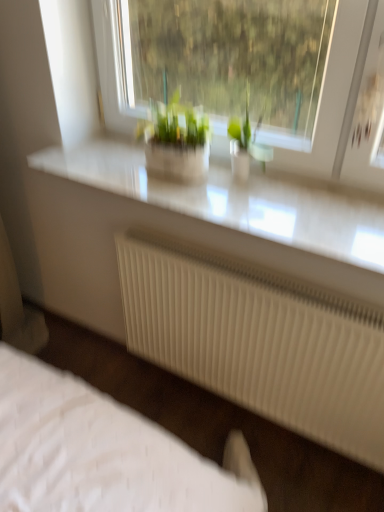
The width and height of the screenshot is (384, 512). Describe the element at coordinates (246, 144) in the screenshot. I see `green glass vase at center, the 2th houseplant positioned from the left` at that location.

Find the location of `green matte plant at center, the 2th houseplant from the right`. green matte plant at center, the 2th houseplant from the right is located at coordinates (176, 140).

Locate an element on the screen. The height and width of the screenshot is (512, 384). white ribbed radiator at lower center is located at coordinates (260, 343).

Does green matte plant at center, which is counted as the first houseplant, starting from the left, touch white quilted bed at lower left?

They are not placed beside each other.

Image resolution: width=384 pixels, height=512 pixels. I want to click on the 2nd houseplant above the white quilted bed at lower left (from the image's perspective), so click(x=176, y=140).

Which of these two, green matte plant at center, which is counted as the first houseplant, starting from the left, or white quilted bed at lower left, is wider?

white quilted bed at lower left is wider.

Identify the location of radiator on the left of green glass vase at center, the 2th houseplant positioned from the left. click(x=260, y=343).

Who is shorter, white ribbed radiator at lower center or green glass vase at center, which is the first houseplant in right-to-left order?

Standing shorter between the two is green glass vase at center, which is the first houseplant in right-to-left order.

Does white ribbed radiator at lower center lie in front of green glass vase at center, the 2th houseplant positioned from the left?

Yes, it is in front of green glass vase at center, the 2th houseplant positioned from the left.

Based on the photo, how distant is white quilted bed at lower left from white glossy counter top at upper center?

white quilted bed at lower left is 25.00 inches away from white glossy counter top at upper center.

Considering the relative sizes of white quilted bed at lower left and white glossy counter top at upper center in the image provided, is white quilted bed at lower left smaller than white glossy counter top at upper center?

No, white quilted bed at lower left is not smaller than white glossy counter top at upper center.

Is white glossy counter top at upper center at the back of white quilted bed at lower left?

No, white quilted bed at lower left is not facing away from white glossy counter top at upper center.

How different are the orientations of white quilted bed at lower left and green glass vase at center, the 2th houseplant positioned from the left, in degrees?

1.11 degrees separate the facing orientations of white quilted bed at lower left and green glass vase at center, the 2th houseplant positioned from the left.

Which object is wider, white quilted bed at lower left or green glass vase at center, the 2th houseplant positioned from the left?

white quilted bed at lower left.

From the image's perspective, is white quilted bed at lower left on green glass vase at center, the 2th houseplant positioned from the left?

No.

Is white quilted bed at lower left positioned with its back to green glass vase at center, the 2th houseplant positioned from the left?

No.

From a real-world perspective, is green glass vase at center, the 2th houseplant positioned from the left, below white glossy counter top at upper center?

No, from a real-world perspective, green glass vase at center, the 2th houseplant positioned from the left, is not under white glossy counter top at upper center.

Can you confirm if green glass vase at center, the 2th houseplant positioned from the left, is taller than white glossy counter top at upper center?

Yes.

Which object is further away from the camera, green glass vase at center, the 2th houseplant positioned from the left, or white glossy counter top at upper center?

green glass vase at center, the 2th houseplant positioned from the left, is behind.

Which is more to the right, green glass vase at center, which is the first houseplant in right-to-left order, or green matte plant at center, the 2th houseplant from the right?

green glass vase at center, which is the first houseplant in right-to-left order, is more to the right.

Is green glass vase at center, the 2th houseplant positioned from the left, aimed at green matte plant at center, which is counted as the first houseplant, starting from the left?

No, green glass vase at center, the 2th houseplant positioned from the left, is not turned towards green matte plant at center, which is counted as the first houseplant, starting from the left.

From the image's perspective, is green glass vase at center, which is the first houseplant in right-to-left order, over green matte plant at center, the 2th houseplant from the right?

No, from the image's perspective, green glass vase at center, which is the first houseplant in right-to-left order, is not above green matte plant at center, the 2th houseplant from the right.

Is green glass vase at center, the 2th houseplant positioned from the left, far away from green matte plant at center, which is counted as the first houseplant, starting from the left?

No, green glass vase at center, the 2th houseplant positioned from the left, is in close proximity to green matte plant at center, which is counted as the first houseplant, starting from the left.

Is the position of white glossy counter top at upper center more distant than that of white quilted bed at lower left?

No, it is in front of white quilted bed at lower left.

Is white glossy counter top at upper center completely or partially outside of white quilted bed at lower left?

Yes, white glossy counter top at upper center is not within white quilted bed at lower left.

Would you say white glossy counter top at upper center is to the left or to the right of white quilted bed at lower left in the picture?

white glossy counter top at upper center is to the right of white quilted bed at lower left.

Image resolution: width=384 pixels, height=512 pixels. Find the location of `bed behind the green matte plant at center, the 2th houseplant from the right`. bed behind the green matte plant at center, the 2th houseplant from the right is located at coordinates (103, 452).

You are a GUI agent. You are given a task and a screenshot of the screen. Output one action in this format:
    pyautogui.click(x=<x>, y=<y>)
    Task: Click on the houseplant on the right of white ribbed radiator at lower center
    
    Given the screenshot: What is the action you would take?
    pyautogui.click(x=246, y=144)

Based on their spatial positions, is green glass vase at center, which is the first houseplant in right-to-left order, or white glossy counter top at upper center closer to green matte plant at center, which is counted as the first houseplant, starting from the left?

green glass vase at center, which is the first houseplant in right-to-left order.

From the image, which object appears to be farther from white quilted bed at lower left, green glass vase at center, the 2th houseplant positioned from the left, or white ribbed radiator at lower center?

green glass vase at center, the 2th houseplant positioned from the left, is further to white quilted bed at lower left.

Considering their positions, is white ribbed radiator at lower center positioned closer to white quilted bed at lower left than green matte plant at center, which is counted as the first houseplant, starting from the left?

white ribbed radiator at lower center is closer to white quilted bed at lower left.

Considering their positions, is white quilted bed at lower left positioned closer to white glossy counter top at upper center than green matte plant at center, the 2th houseplant from the right?

green matte plant at center, the 2th houseplant from the right, lies closer to white glossy counter top at upper center than the other object.

From the image, which object appears to be farther from white ribbed radiator at lower center, green matte plant at center, which is counted as the first houseplant, starting from the left, or green glass vase at center, the 2th houseplant positioned from the left?

green glass vase at center, the 2th houseplant positioned from the left, is further to white ribbed radiator at lower center.

Based on their spatial positions, is green glass vase at center, which is the first houseplant in right-to-left order, or white quilted bed at lower left closer to green matte plant at center, the 2th houseplant from the right?

green glass vase at center, which is the first houseplant in right-to-left order, is closer to green matte plant at center, the 2th houseplant from the right.

When comparing their distances from white ribbed radiator at lower center, does white quilted bed at lower left or green matte plant at center, which is counted as the first houseplant, starting from the left, seem closer?

white quilted bed at lower left.

Consider the image. Which object lies nearer to the anchor point white quilted bed at lower left, green glass vase at center, which is the first houseplant in right-to-left order, or green matte plant at center, the 2th houseplant from the right?

Among the two, green matte plant at center, the 2th houseplant from the right, is located nearer to white quilted bed at lower left.

Where is `counter top between green matte plant at center, which is counted as the first houseplant, starting from the left, and white ribbed radiator at lower center vertically`? The height and width of the screenshot is (512, 384). counter top between green matte plant at center, which is counted as the first houseplant, starting from the left, and white ribbed radiator at lower center vertically is located at coordinates (234, 201).

Where is `counter top between green glass vase at center, the 2th houseplant positioned from the left, and white quilted bed at lower left vertically`? counter top between green glass vase at center, the 2th houseplant positioned from the left, and white quilted bed at lower left vertically is located at coordinates pos(234,201).

Locate an element on the screen. The image size is (384, 512). counter top between green matte plant at center, the 2th houseplant from the right, and green glass vase at center, which is the first houseplant in right-to-left order, in the horizontal direction is located at coordinates (234, 201).

Where is `counter top that lies between green matte plant at center, which is counted as the first houseplant, starting from the left, and white quilted bed at lower left from top to bottom`? Image resolution: width=384 pixels, height=512 pixels. counter top that lies between green matte plant at center, which is counted as the first houseplant, starting from the left, and white quilted bed at lower left from top to bottom is located at coordinates (234, 201).